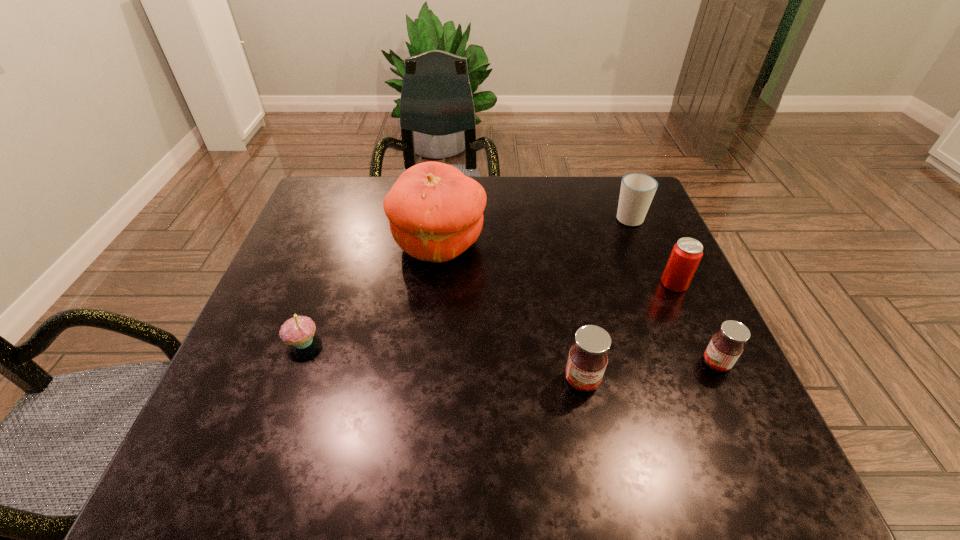
At what (x,y) coordinates should I click in order to perform the action: click on free location located 0.220m on the label side of the right jam. Please return your answer as a coordinate pair (x, y). The width and height of the screenshot is (960, 540). Looking at the image, I should click on (588, 363).

Locate an element on the screen. The height and width of the screenshot is (540, 960). vacant region located with a handle on the side of the cup is located at coordinates (619, 192).

Locate an element on the screen. The image size is (960, 540). free spot located with a handle on the side of the cup is located at coordinates (619, 194).

This screenshot has height=540, width=960. What are the coordinates of `vacant space located with a handle on the side of the cup` in the screenshot? It's located at (612, 176).

Where is `vacant area situated 0.210m on the left of the pumpkin`? This screenshot has width=960, height=540. vacant area situated 0.210m on the left of the pumpkin is located at coordinates pyautogui.click(x=309, y=244).

Find the location of a particular element. The width and height of the screenshot is (960, 540). free space located on the front of the cupcake is located at coordinates (280, 406).

At what (x,y) coordinates should I click in order to perform the action: click on vacant region located 0.080m on the back of the can. Please return your answer as a coordinate pair (x, y). Image resolution: width=960 pixels, height=540 pixels. Looking at the image, I should click on (660, 252).

You are a GUI agent. You are given a task and a screenshot of the screen. Output one action in this format:
    pyautogui.click(x=<x>, y=<y>)
    Task: Click on the cup at the far edge
    This screenshot has height=540, width=960.
    Given the screenshot: What is the action you would take?
    point(637,190)

Identify the location of pumpkin positioned at the far edge. (435, 212).

I want to click on object located in the near edge section of the desktop, so click(587, 360).